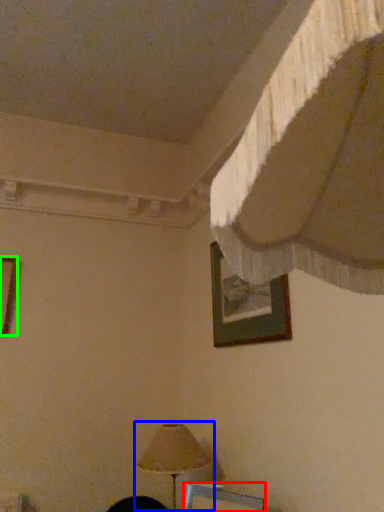
Question: Considering the real-world distances, which object is closest to picture frame (highlighted by a red box)? lamp (highlighted by a blue box) or picture frame (highlighted by a green box).

Choices:
 (A) lamp
 (B) picture frame

Answer: (A)